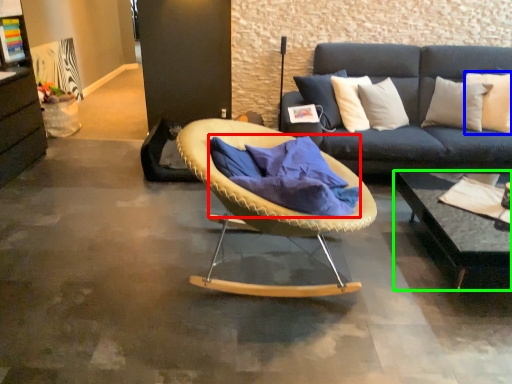
Question: Based on their relative distances, which object is farther from blanket (highlighted by a red box)? Choose from pillow (highlighted by a blue box) and coffee table (highlighted by a green box).

Choices:
 (A) pillow
 (B) coffee table

Answer: (A)